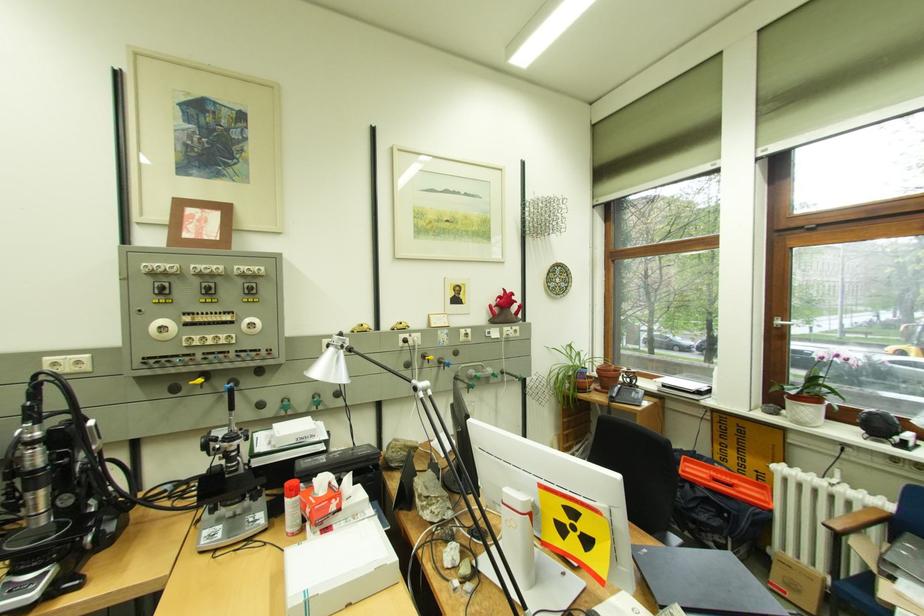
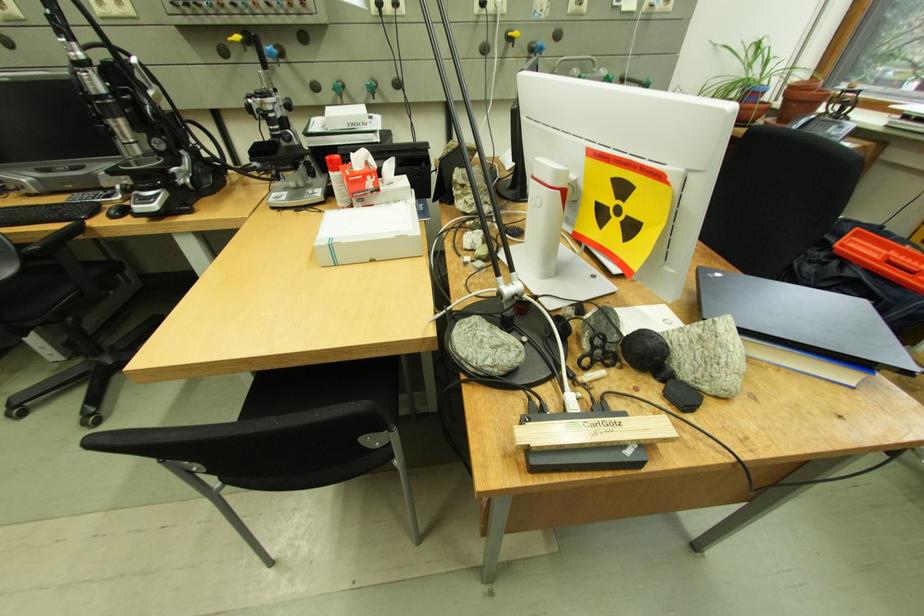
Based on the continuous images, in which direction is the camera rotating?

The camera's rotation is toward left-down.